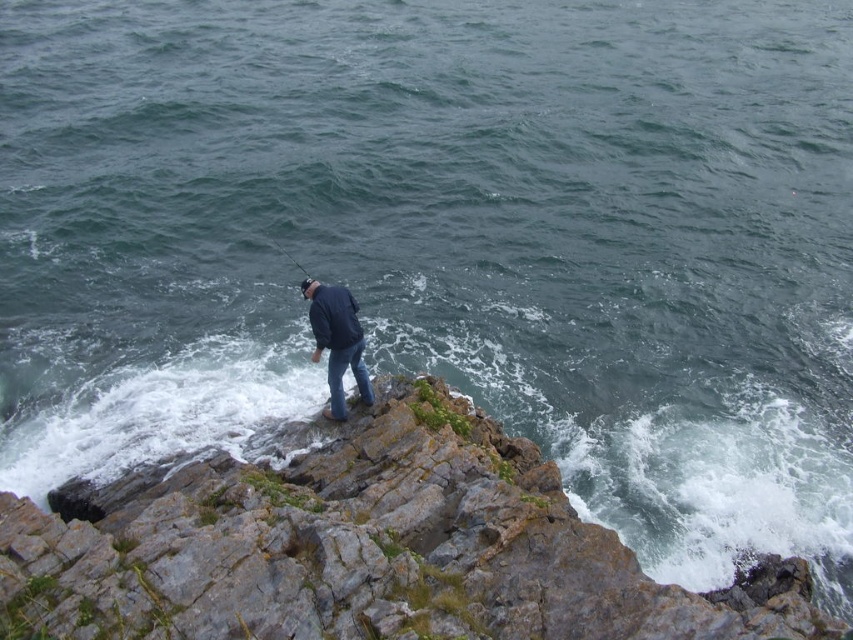
Question: Which of the following is the farthest from the observer?

Choices:
 (A) smooth black rod at center
 (B) gray rocky cliff at center
 (C) dark blue jacket at center

Answer: (A)

Question: Can you confirm if dark blue jacket at center is thinner than smooth black rod at center?

Choices:
 (A) yes
 (B) no

Answer: (B)

Question: Among these objects, which one is farthest from the camera?

Choices:
 (A) gray rocky cliff at center
 (B) smooth black rod at center
 (C) dark blue jacket at center

Answer: (B)

Question: Is gray rocky cliff at center wider than dark blue jacket at center?

Choices:
 (A) no
 (B) yes

Answer: (A)

Question: Does dark blue jacket at center have a greater width compared to smooth black rod at center?

Choices:
 (A) no
 (B) yes

Answer: (B)

Question: Which of the following is the closest to the observer?

Choices:
 (A) smooth black rod at center
 (B) dark blue jacket at center
 (C) gray rocky cliff at center

Answer: (C)